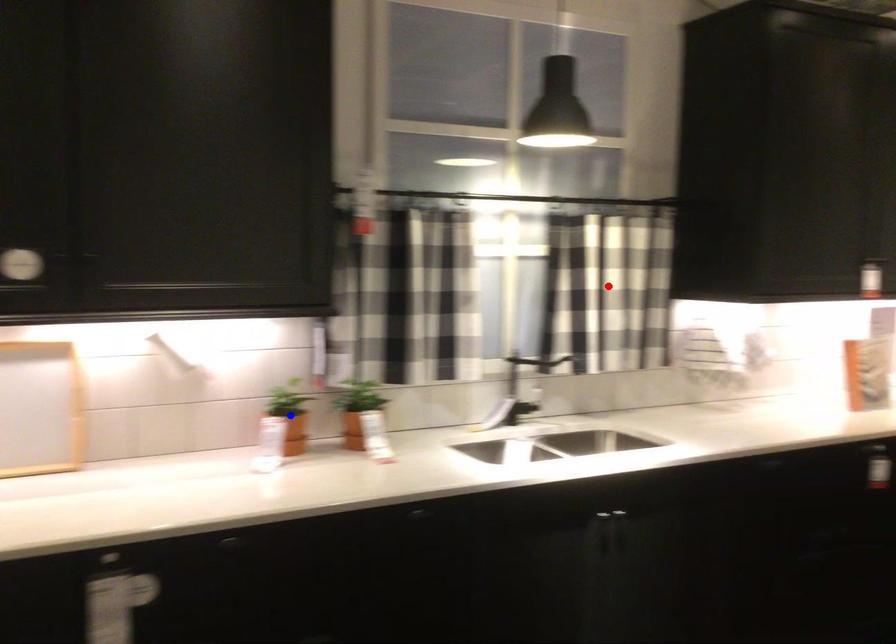
Question: Which of the two points in the image is closer to the camera?

Choices:
 (A) Blue point is closer.
 (B) Red point is closer.

Answer: (A)